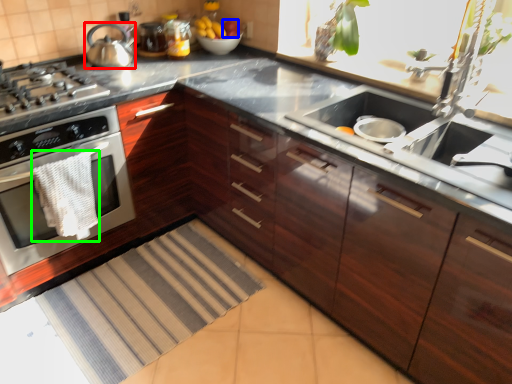
Question: Considering the real-world distances, which object is farthest from kitchen appliance (highlighted by a red box)? apple (highlighted by a blue box) or material (highlighted by a green box)?

Choices:
 (A) apple
 (B) material

Answer: (B)